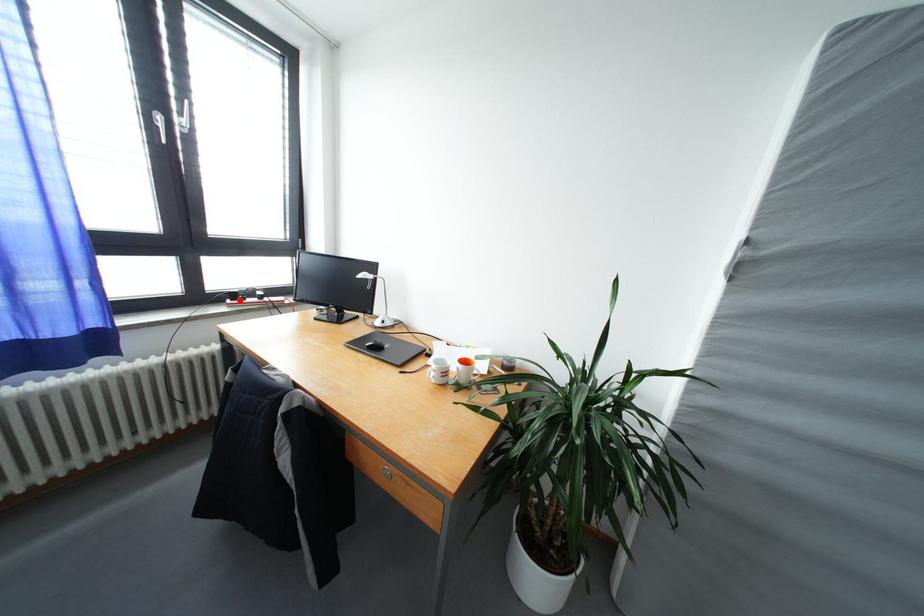
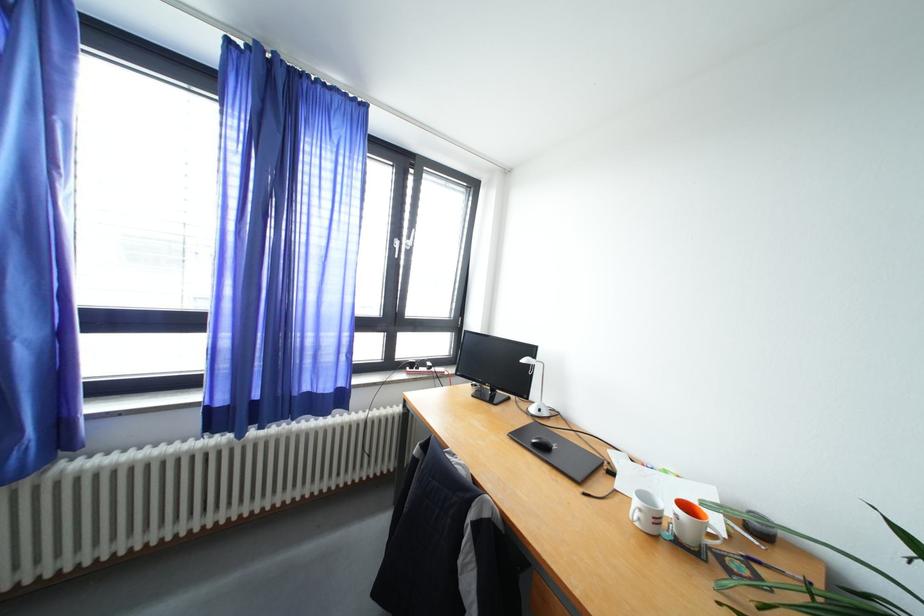
The point at the highlighted location is marked in the first image. Where is the corresponding point in the second image?

(419, 370)